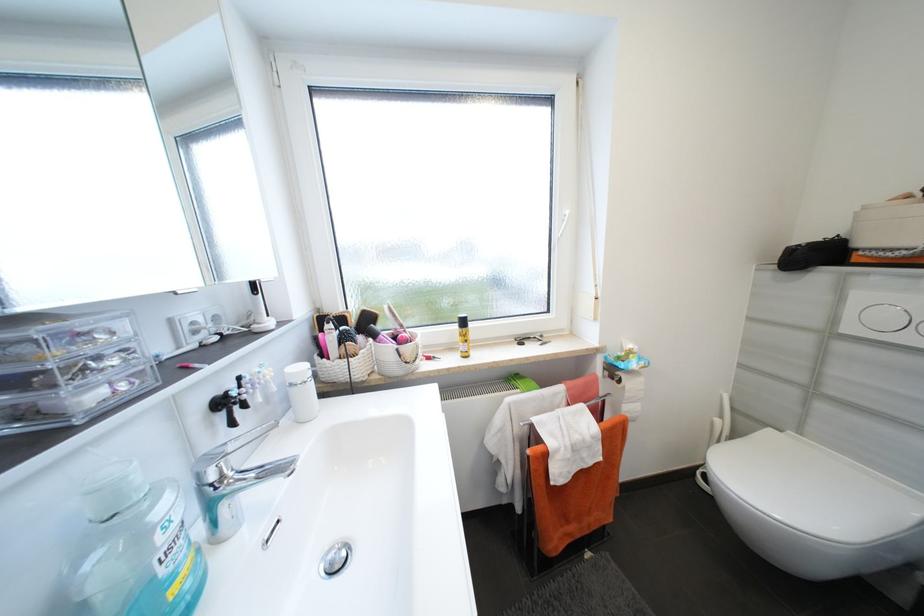
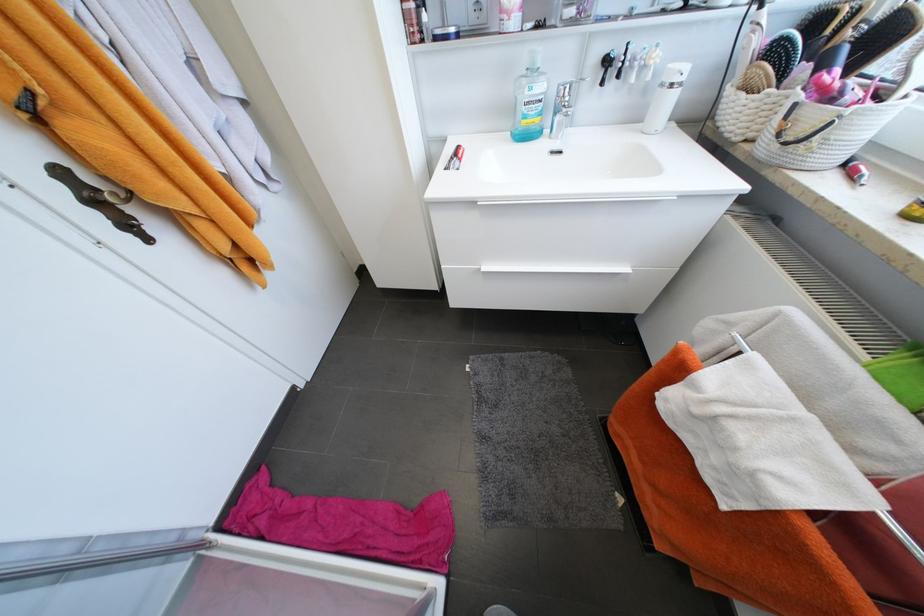
Locate, in the second image, the point that corresponds to (x=216, y=507) in the first image.

(562, 113)